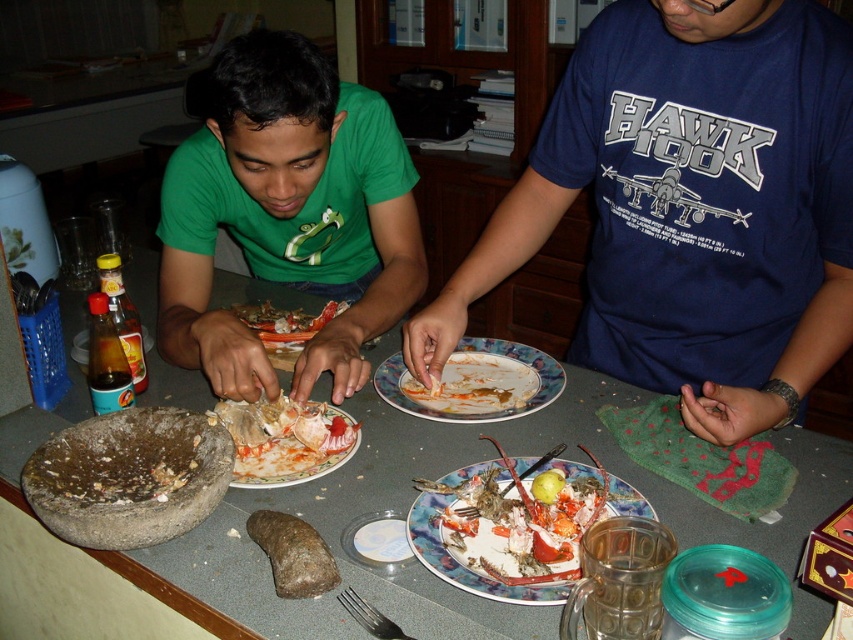
Question: Which point is closer to the camera?

Choices:
 (A) (270, 321)
 (B) (537, 180)

Answer: (B)

Question: Which object is farther from the camera taking this photo?

Choices:
 (A) shiny red lobster at center
 (B) shiny orange lobster at center
 (C) crusty ceramic plate at center
 (D) white matte plate at center

Answer: (B)

Question: Is blue cotton shirt at center to the right of smooth gray table at center from the viewer's perspective?

Choices:
 (A) yes
 (B) no

Answer: (A)

Question: Which point is farther to the camera?

Choices:
 (A) shiny red lobster at center
 (B) blue cotton shirt at center

Answer: (A)

Question: Is smooth gray table at center positioned before green matte shirt at center?

Choices:
 (A) no
 (B) yes

Answer: (B)

Question: Is shiny red lobster at center to the right of shiny orange lobster at center from the viewer's perspective?

Choices:
 (A) yes
 (B) no

Answer: (A)